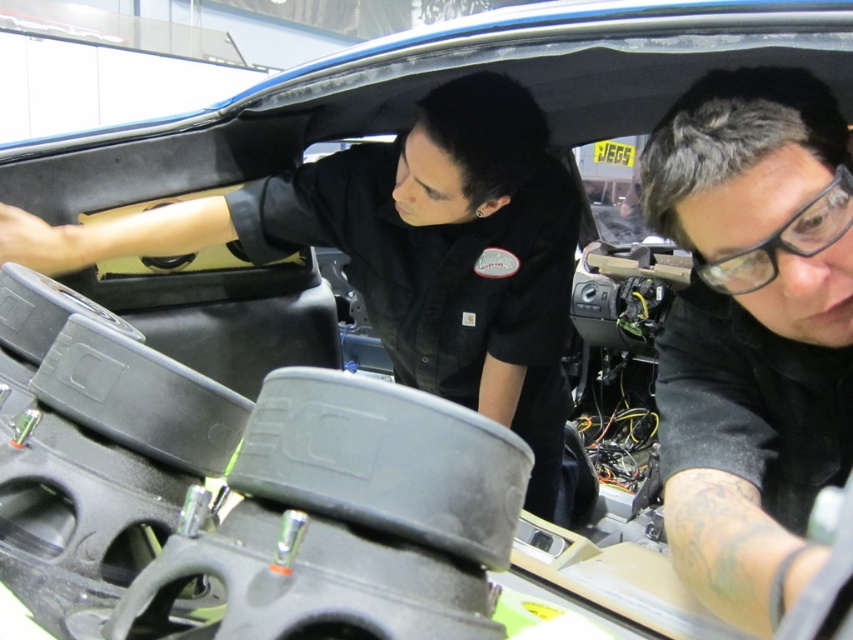
You are a customer service representative who needs to determine which of the two workers in the car is the supervisor based on their clothing size. According to company policy, the supervisor always wears a larger uniform shirt. Which worker, the black matte shirt at center or the black matte shirt at upper center, is the supervisor?

The supervisor is the black matte shirt at upper center because it has a larger size compared to the black matte shirt at center, as per the company policy requiring supervisors to wear larger uniforms.

You are a technician working on a car and need to access two points inside the car. The first point is at coordinate point (753, 339) and the second is at coordinate point (144, 244). Which point will you reach first without moving your position?

Point (753, 339) is closer to the viewer than point (144, 244), so you will reach point (753, 339) first.

You are standing in front of the car in the image and want to reach the point at coordinates point (x=694, y=204). If your arm can extend 28 inches, can you reach it?

The point (x=694, y=204) is 28.94 inches away from the camera, so your arm can only extend 28 inches. Therefore, you cannot reach it.